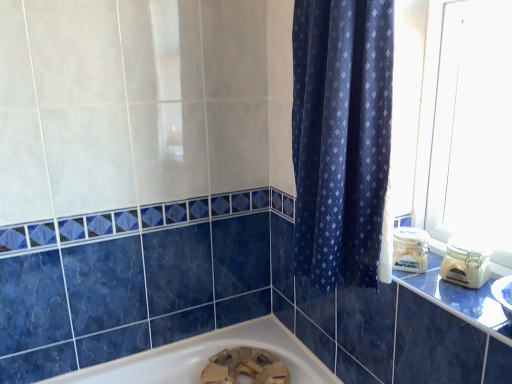
Question: Considering the relative positions of dark blue fabric curtain at center and black glossy counter top at right in the image provided, is dark blue fabric curtain at center to the left of black glossy counter top at right from the viewer's perspective?

Choices:
 (A) yes
 (B) no

Answer: (A)

Question: From a real-world perspective, is dark blue fabric curtain at center over black glossy counter top at right?

Choices:
 (A) no
 (B) yes

Answer: (B)

Question: Does dark blue fabric curtain at center have a lesser width compared to black glossy counter top at right?

Choices:
 (A) no
 (B) yes

Answer: (B)

Question: From a real-world perspective, is dark blue fabric curtain at center under black glossy counter top at right?

Choices:
 (A) yes
 (B) no

Answer: (B)

Question: Is dark blue fabric curtain at center in front of black glossy counter top at right?

Choices:
 (A) no
 (B) yes

Answer: (A)

Question: Does dark blue fabric curtain at center turn towards black glossy counter top at right?

Choices:
 (A) yes
 (B) no

Answer: (B)

Question: From the image's perspective, is black glossy counter top at right beneath dark blue fabric curtain at center?

Choices:
 (A) no
 (B) yes

Answer: (B)

Question: Is black glossy counter top at right to the left of dark blue fabric curtain at center from the viewer's perspective?

Choices:
 (A) yes
 (B) no

Answer: (B)

Question: Can we say black glossy counter top at right lies outside dark blue fabric curtain at center?

Choices:
 (A) yes
 (B) no

Answer: (A)

Question: Is black glossy counter top at right oriented away from dark blue fabric curtain at center?

Choices:
 (A) yes
 (B) no

Answer: (B)

Question: Considering the relative sizes of black glossy counter top at right and dark blue fabric curtain at center in the image provided, is black glossy counter top at right bigger than dark blue fabric curtain at center?

Choices:
 (A) yes
 (B) no

Answer: (B)

Question: Can you confirm if black glossy counter top at right is thinner than dark blue fabric curtain at center?

Choices:
 (A) no
 (B) yes

Answer: (A)

Question: Does point (487, 329) appear closer or farther from the camera than point (318, 13)?

Choices:
 (A) closer
 (B) farther

Answer: (A)